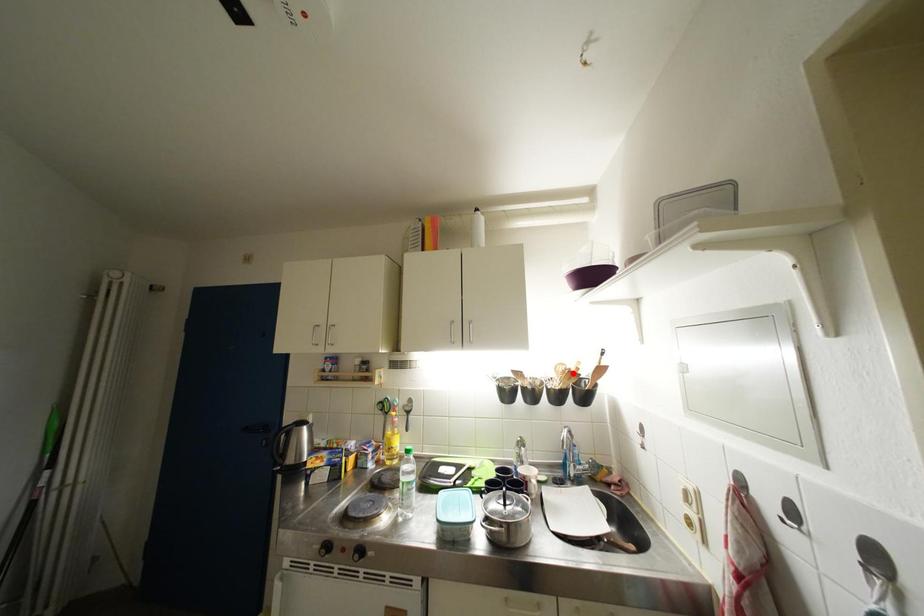
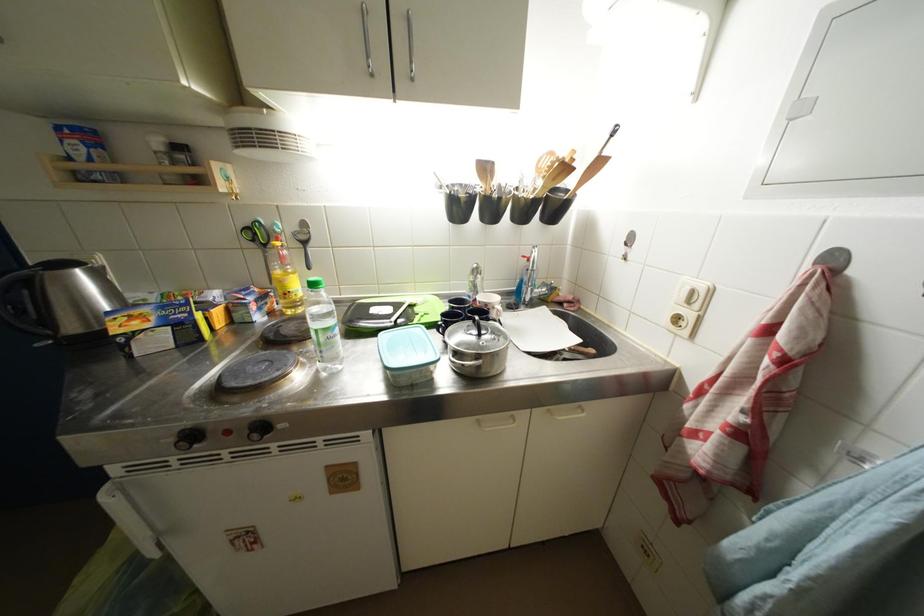
Find the pixel in the second image that matches the highlighted location in the first image.

(565, 164)